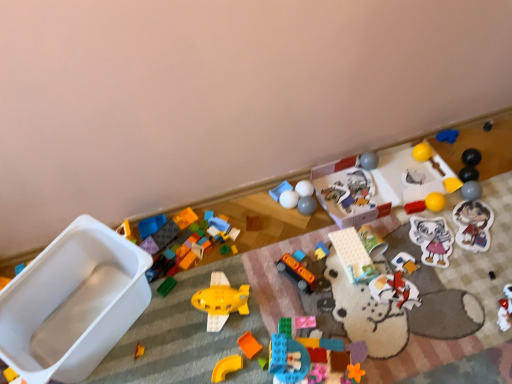
The image size is (512, 384). In order to click on vacant space that's between orange matte bus at center, the tenth toy when ordered from left to right, and yellow plastic airplane at center, the 22th toy in the right-to-left sequence in this screenshot , I will do `click(266, 292)`.